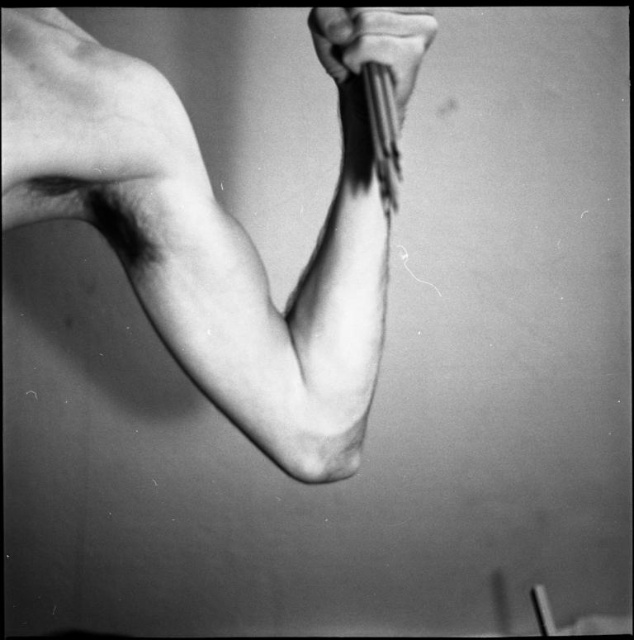
You are an artist sketching a hand holding an object. You have a smooth skin arm at center and a smooth black pen at upper center in your drawing. Which object should you make bigger in your drawing?

The smooth skin arm at center should be made bigger in the drawing since it has a larger size compared to the smooth black pen at upper center according to the description.

You are a photographer who wants to capture a closeup of the smooth skin arm at center. The camera you are using has a minimum focusing distance of 12 inches. Can you take the photo without moving the camera closer?

The smooth skin arm at center is 15.30 inches away from the viewer. Since the camera can focus as close as 12 inches, which is closer than the current distance, you can take the photo without moving the camera closer because the distance is within the camera s focusing range.

You are an artist sketching a hand and need to decide which object to draw first. The smooth skin arm at center and the smooth black pen at upper center are both in your view. Based on their sizes, which one should you draw first?

The smooth skin arm at center is wider than the smooth black pen at upper center, so you should draw the smooth skin arm at center first since it is larger in size.